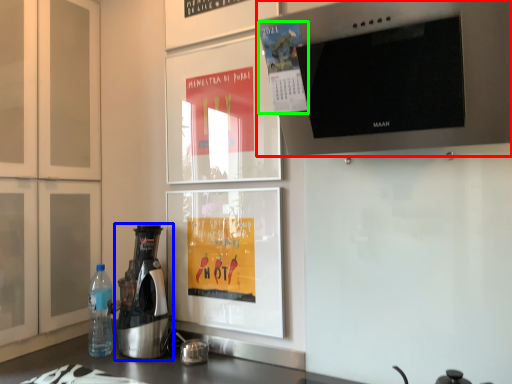
Question: Estimate the real-world distances between objects in this image. Which object is farther from home appliance (highlighted by a red box), kitchen appliance (highlighted by a blue box) or poster (highlighted by a green box)?

Choices:
 (A) kitchen appliance
 (B) poster

Answer: (A)